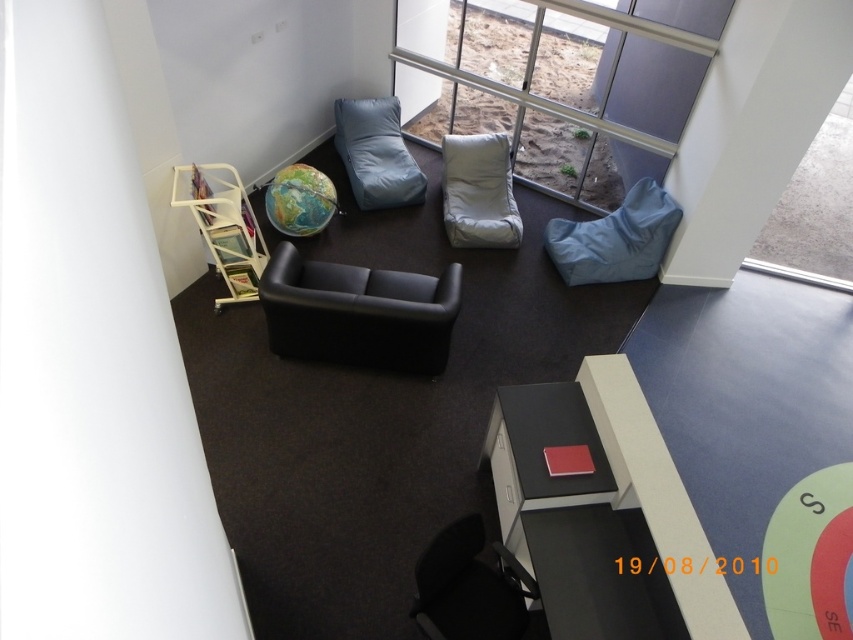
Question: Which point appears farthest from the camera in this image?

Choices:
 (A) (347, 160)
 (B) (376, 300)

Answer: (A)

Question: Does transparent glass window at upper right appear on the left side of matte blue bean bag at right?

Choices:
 (A) no
 (B) yes

Answer: (A)

Question: Based on their relative distances, which object is farther from the transparent glass window at upper center?

Choices:
 (A) matte blue bean bag at upper center
 (B) black leather couch at center
 (C) matte blue bean bag at right

Answer: (B)

Question: Where is transparent glass window at upper center located in relation to metal frame chair at left in the image?

Choices:
 (A) right
 (B) left

Answer: (A)

Question: Which of the following is the closest to the observer?

Choices:
 (A) (225, 257)
 (B) (634, 275)

Answer: (A)

Question: Is transparent glass window at upper center thinner than black leather couch at center?

Choices:
 (A) yes
 (B) no

Answer: (B)